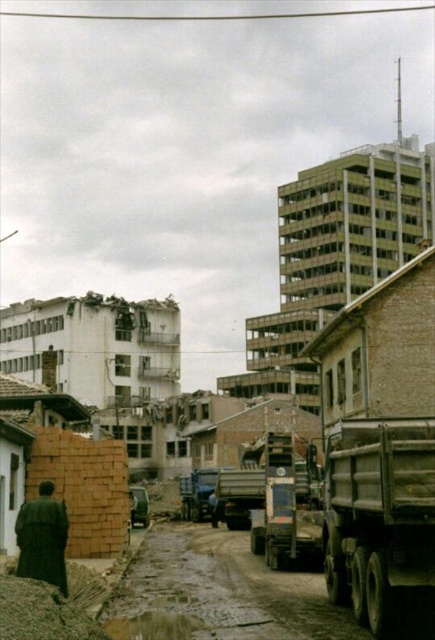
Question: Does metallic gray truck at center appear over dark matte coat at lower left?

Choices:
 (A) yes
 (B) no

Answer: (B)

Question: Which is nearer to the gray metallic truck at lower right?

Choices:
 (A) dark matte coat at lower left
 (B) brown clay mud at lower left
 (C) matte blue truck at center
 (D) metallic gray truck at center

Answer: (B)

Question: Can you confirm if brown clay mud at lower left is wider than matte blue truck at center?

Choices:
 (A) no
 (B) yes

Answer: (A)

Question: Is brown clay mud at lower left bigger than dark matte coat at lower left?

Choices:
 (A) yes
 (B) no

Answer: (A)

Question: Among these objects, which one is nearest to the camera?

Choices:
 (A) metallic gray truck at center
 (B) gray metallic truck at lower right
 (C) dark matte coat at lower left

Answer: (B)

Question: Which point appears closest to the camera in this image?

Choices:
 (A) (3, 588)
 (B) (371, 518)
 (C) (214, 472)

Answer: (A)